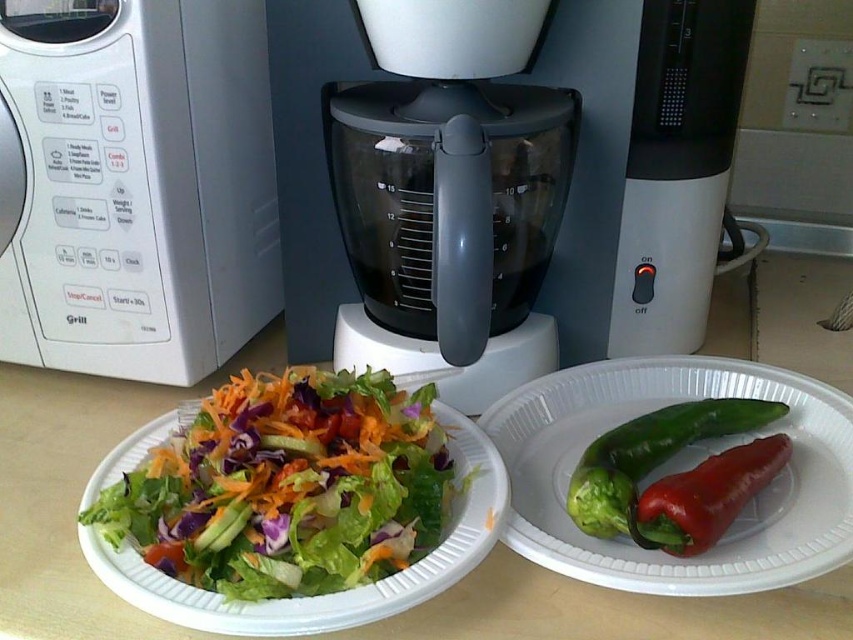
Does point (242, 259) come closer to viewer compared to point (345, 524)?

No, it is not.

Who is positioned more to the left, white plastic microwave at left or fresh green salad at center?

From the viewer's perspective, white plastic microwave at left appears more on the left side.

Is point (149, 276) more distant than point (358, 512)?

Yes, it is behind point (358, 512).

The width and height of the screenshot is (853, 640). In order to click on white plastic microwave at left in this screenshot , I will do `click(138, 186)`.

Between white plastic microwave at left and green matte paper plate at right, which one appears on the left side from the viewer's perspective?

Positioned to the left is white plastic microwave at left.

Is white plastic microwave at left above green matte paper plate at right?

Yes, white plastic microwave at left is above green matte paper plate at right.

Which is in front, point (173, 38) or point (619, 570)?

Point (619, 570) is in front.

Identify the location of white plastic microwave at left. The height and width of the screenshot is (640, 853). (x=138, y=186).

Can you confirm if white plastic microwave at left is positioned to the left of green matte pepper at center?

Yes, white plastic microwave at left is to the left of green matte pepper at center.

Who is lower down, white plastic microwave at left or green matte pepper at center?

green matte pepper at center is lower down.

This screenshot has width=853, height=640. What do you see at coordinates (138, 186) in the screenshot?
I see `white plastic microwave at left` at bounding box center [138, 186].

Where is `white plastic microwave at left`? The image size is (853, 640). white plastic microwave at left is located at coordinates (138, 186).